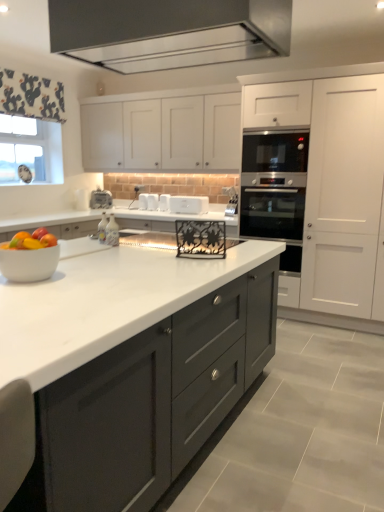
Question: Is shiny plastic bowl of mixed fruits at center-left smaller than satin metallic exhaust hood at upper center?

Choices:
 (A) yes
 (B) no

Answer: (A)

Question: Could you tell me if shiny plastic bowl of mixed fruits at center-left is facing satin metallic exhaust hood at upper center?

Choices:
 (A) no
 (B) yes

Answer: (A)

Question: Is shiny plastic bowl of mixed fruits at center-left outside of satin metallic exhaust hood at upper center?

Choices:
 (A) yes
 (B) no

Answer: (A)

Question: Considering the relative sizes of shiny plastic bowl of mixed fruits at center-left and satin metallic exhaust hood at upper center in the image provided, is shiny plastic bowl of mixed fruits at center-left thinner than satin metallic exhaust hood at upper center?

Choices:
 (A) no
 (B) yes

Answer: (B)

Question: Can you confirm if shiny plastic bowl of mixed fruits at center-left is positioned to the right of satin metallic exhaust hood at upper center?

Choices:
 (A) no
 (B) yes

Answer: (A)

Question: From the image's perspective, does shiny plastic bowl of mixed fruits at center-left appear higher than satin metallic exhaust hood at upper center?

Choices:
 (A) no
 (B) yes

Answer: (A)

Question: Is the position of white matte toaster at center, arranged as the third appliance when viewed from the left, less distant than that of white glossy toaster at center, the 5th appliance from the left?

Choices:
 (A) yes
 (B) no

Answer: (B)

Question: Is white matte toaster at center, arranged as the third appliance when viewed from the left, oriented away from white glossy toaster at center, which is the 1th appliance from right to left?

Choices:
 (A) no
 (B) yes

Answer: (A)

Question: Is white glossy toaster at center, which is the 1th appliance from right to left, inside white matte toaster at center, arranged as the third appliance when viewed from the right?

Choices:
 (A) yes
 (B) no

Answer: (B)

Question: Can we say white matte toaster at center, arranged as the third appliance when viewed from the left, lies outside white glossy toaster at center, the 5th appliance from the left?

Choices:
 (A) no
 (B) yes

Answer: (B)

Question: Can you confirm if white matte toaster at center, arranged as the third appliance when viewed from the right, is shorter than white glossy toaster at center, which is the 1th appliance from right to left?

Choices:
 (A) yes
 (B) no

Answer: (A)

Question: Is white glossy toaster at center, which is the 1th appliance from right to left, at the left side of satin silver oven at center-right?

Choices:
 (A) no
 (B) yes

Answer: (B)